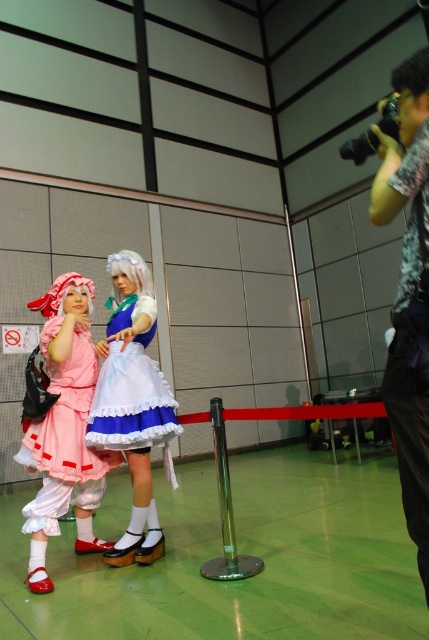
Who is higher up, dark floral shirt at right or matte pink dress at left?

dark floral shirt at right is higher up.

Can you confirm if dark floral shirt at right is positioned above matte pink dress at left?

Correct, dark floral shirt at right is located above matte pink dress at left.

Which is in front, point (426, 604) or point (81, 518)?

Point (426, 604)

I want to click on dark floral shirt at right, so click(408, 292).

Who is more forward, [401,132] or [392,72]?

Point [401,132] is more forward.

Does point (417, 56) come in front of point (416, 93)?

No, (417, 56) is further to viewer.

Between point (410, 474) and point (416, 81), which one is positioned behind?

Point (416, 81)

Locate an element on the screen. dark floral shirt at right is located at coordinates (408, 292).

Is matte pink dress at left thinner than white silky wig at center?

Incorrect, matte pink dress at left's width is not less than white silky wig at center's.

Find the location of `matte pink dress at left`. matte pink dress at left is located at coordinates (65, 428).

Identify the location of matte pink dress at left. (x=65, y=428).

I want to click on matte pink dress at left, so click(65, 428).